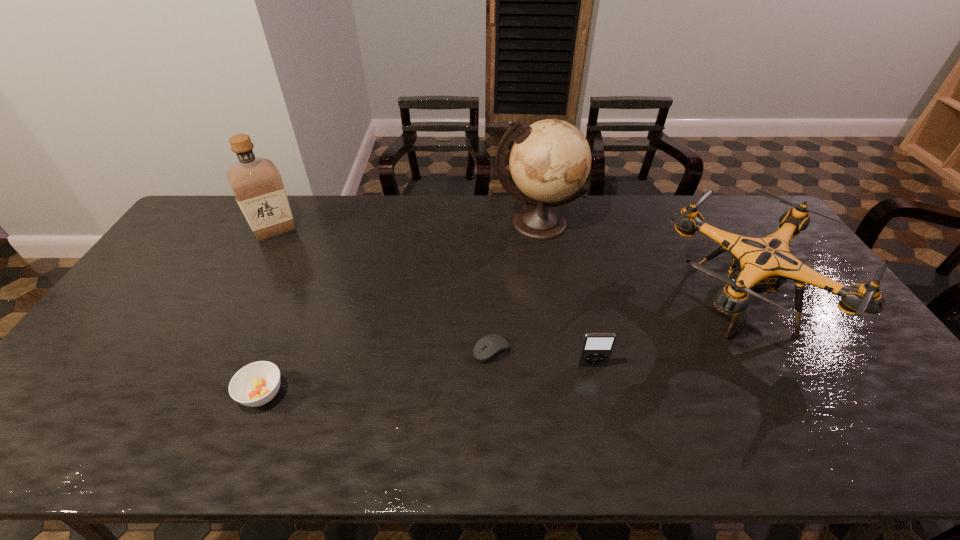
This screenshot has width=960, height=540. What are the coordinates of `blank region between the shortest object and the globe` in the screenshot? It's located at (515, 287).

Where is `vacant space that's between the globe and the liquor`? The width and height of the screenshot is (960, 540). vacant space that's between the globe and the liquor is located at coordinates (406, 227).

Locate an element on the screen. This screenshot has height=540, width=960. free area in between the liquor and the soup bowl is located at coordinates (269, 312).

The image size is (960, 540). I want to click on empty location between the globe and the third shortest object, so click(x=564, y=294).

The width and height of the screenshot is (960, 540). What are the coordinates of `object identified as the fourth closest to the rightmost object` in the screenshot? It's located at [255, 384].

Select which object is the fifth closest to the third tallest object. Please provide its 2D coordinates. Your answer should be formatted as a tuple, i.e. [(x, y)], where the tuple contains the x and y coordinates of a point satisfying the conditions above.

[(256, 183)]

You are a GUI agent. You are given a task and a screenshot of the screen. Output one action in this format:
    pyautogui.click(x=<x>, y=<y>)
    Task: Click on the free space that satisfies the following two spatial constraints: 1. on the front-facing side of the liquor; 2. on the right side of the computer equipment
    The image size is (960, 540).
    Given the screenshot: What is the action you would take?
    pyautogui.click(x=209, y=351)

The height and width of the screenshot is (540, 960). In order to click on blank area in the image that satisfies the following two spatial constraints: 1. on the camera mount of the rightmost object; 2. on the front side of the shortest object in this screenshot , I will do `click(770, 351)`.

Find the location of a particular element. This screenshot has width=960, height=540. vacant position in the image that satisfies the following two spatial constraints: 1. on the front-facing side of the leftmost object; 2. on the right side of the fifth object from right to left is located at coordinates (186, 394).